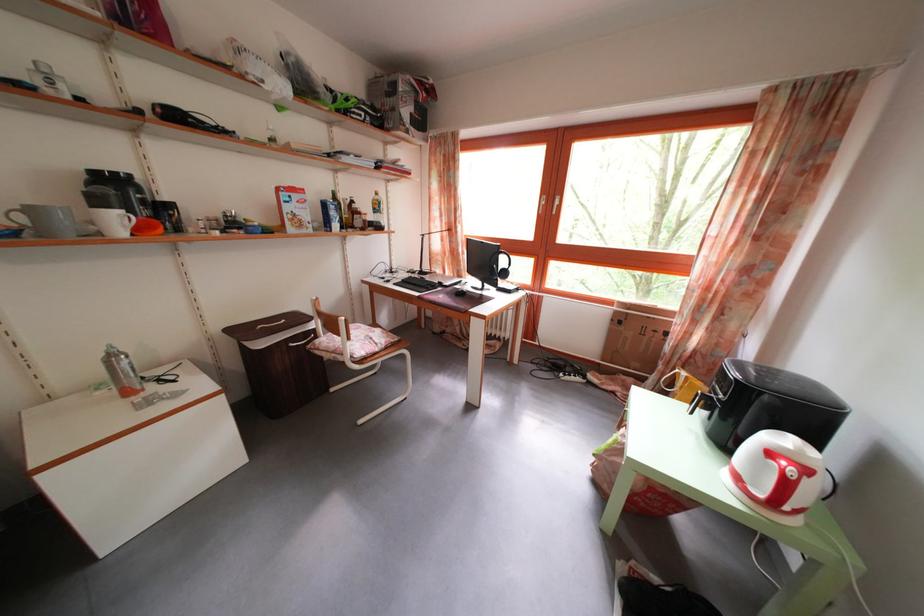
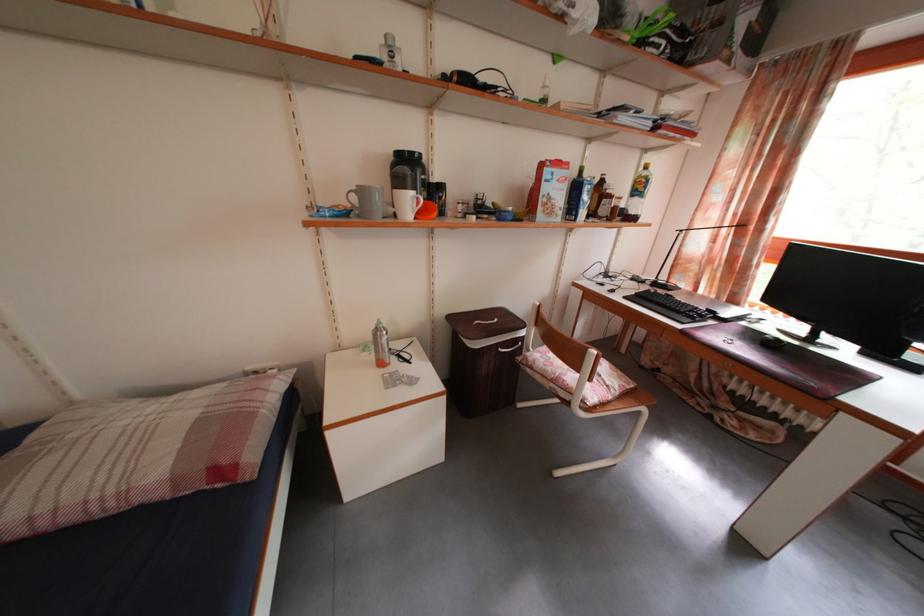
The point at (391, 191) is marked in the first image. Where is the corresponding point in the second image?

(643, 161)